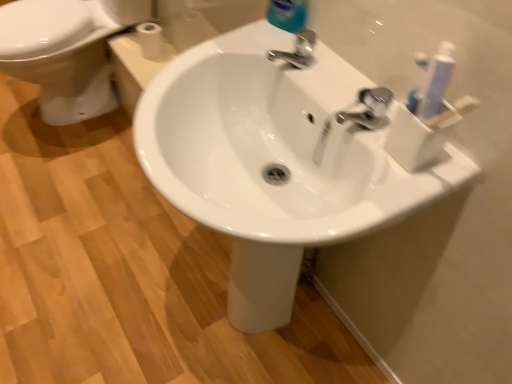
Locate an element on the screen. Image resolution: width=512 pixels, height=384 pixels. vacant space underneath white glossy sink at center (from a real-world perspective) is located at coordinates (241, 329).